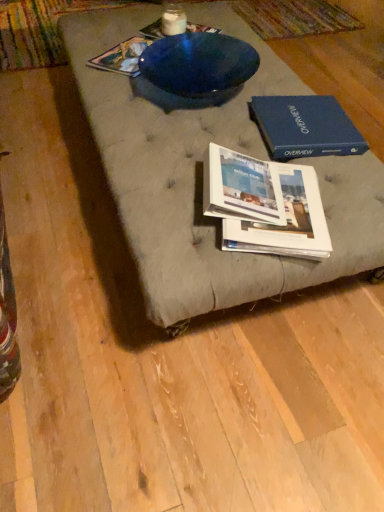
Question: Is white glossy book at center, which is counted as the 4th book, starting from the top, facing towards blue glossy bowl at upper center, marked as the fourth book in a bottom-to-top arrangement?

Choices:
 (A) no
 (B) yes

Answer: (B)

Question: Can you confirm if white glossy book at center, acting as the second book starting from the front, is thinner than blue glossy bowl at upper center, the first book positioned from the top?

Choices:
 (A) no
 (B) yes

Answer: (A)

Question: Can you confirm if white glossy book at center, which ranks as the first book in bottom-to-top order, is bigger than blue glossy bowl at upper center, which is the fourth book from front to back?

Choices:
 (A) no
 (B) yes

Answer: (B)

Question: From the image's perspective, is white glossy book at center, acting as the second book starting from the front, on blue glossy bowl at upper center, which is the fourth book from front to back?

Choices:
 (A) yes
 (B) no

Answer: (B)

Question: Can you confirm if white glossy book at center, which is the 3th book from back to front, is positioned to the left of blue glossy bowl at upper center, the first book positioned from the top?

Choices:
 (A) no
 (B) yes

Answer: (A)

Question: Is blue glossy bowl at upper center, the first book positioned from the top, inside the boundaries of blue hardcover book at upper right, or outside?

Choices:
 (A) inside
 (B) outside

Answer: (B)

Question: Looking at the image, does blue glossy bowl at upper center, marked as the fourth book in a bottom-to-top arrangement, seem bigger or smaller compared to blue hardcover book at upper right?

Choices:
 (A) big
 (B) small

Answer: (B)

Question: From a real-world perspective, is blue glossy bowl at upper center, marked as the fourth book in a bottom-to-top arrangement, positioned above or below blue hardcover book at upper right?

Choices:
 (A) below
 (B) above

Answer: (A)

Question: Is blue glossy bowl at upper center, marked as the fourth book in a bottom-to-top arrangement, in front of or behind blue hardcover book at upper right in the image?

Choices:
 (A) behind
 (B) front

Answer: (A)

Question: Considering the positions of textured gray cushion at center and white glossy book at center, the third book viewed from the top, in the image, is textured gray cushion at center taller or shorter than white glossy book at center, the third book viewed from the top,?

Choices:
 (A) short
 (B) tall

Answer: (A)

Question: From the image's perspective, relative to white glossy book at center, the second book positioned from the bottom, is textured gray cushion at center above or below?

Choices:
 (A) above
 (B) below

Answer: (A)

Question: Relative to white glossy book at center, arranged as the first book when viewed from the front, is textured gray cushion at center in front or behind?

Choices:
 (A) front
 (B) behind

Answer: (A)

Question: Based on their positions, is textured gray cushion at center located to the left or right of white glossy book at center, the third book viewed from the top?

Choices:
 (A) right
 (B) left

Answer: (A)

Question: From the image's perspective, is white glossy book at center, arranged as the first book when viewed from the front, above or below white glossy book at center, which is the 3th book from back to front?

Choices:
 (A) below
 (B) above

Answer: (B)

Question: Is white glossy book at center, which is the fourth book from back to front, taller or shorter than white glossy book at center, acting as the second book starting from the front?

Choices:
 (A) short
 (B) tall

Answer: (B)